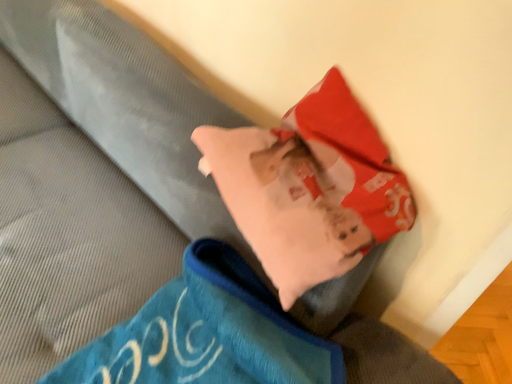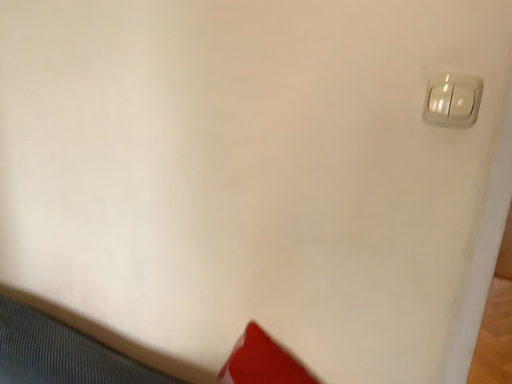
Question: Which way did the camera rotate in the video?

Choices:
 (A) rotated left
 (B) rotated right

Answer: (B)